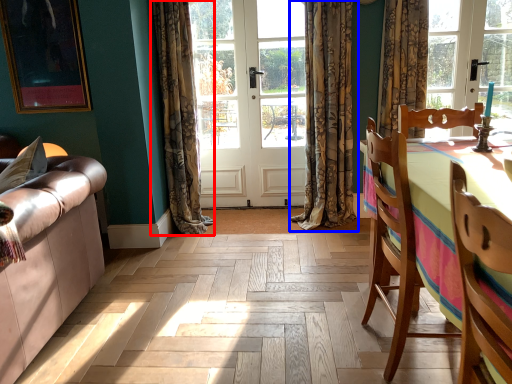
Question: Which object is closer to the camera taking this photo, curtain (highlighted by a red box) or curtain (highlighted by a blue box)?

Choices:
 (A) curtain
 (B) curtain

Answer: (A)